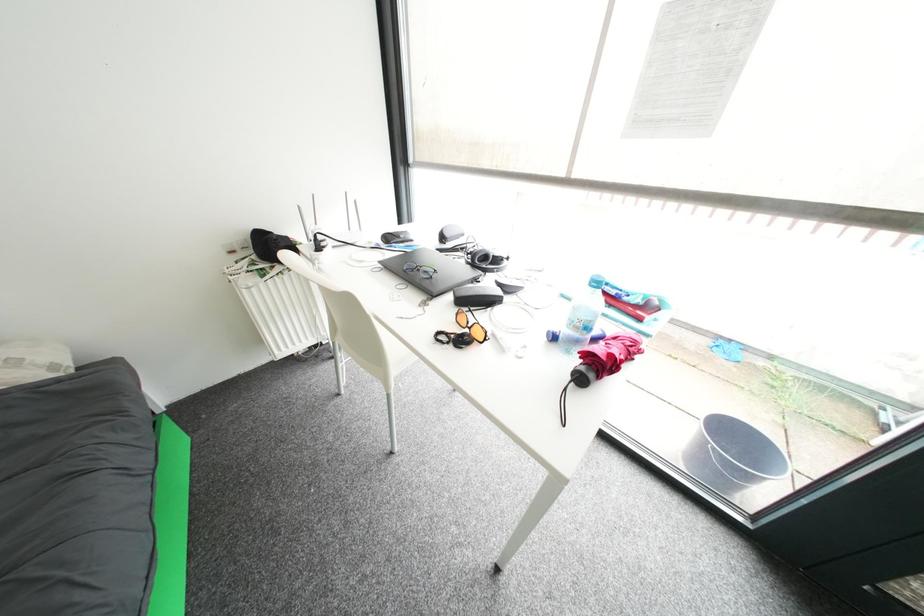
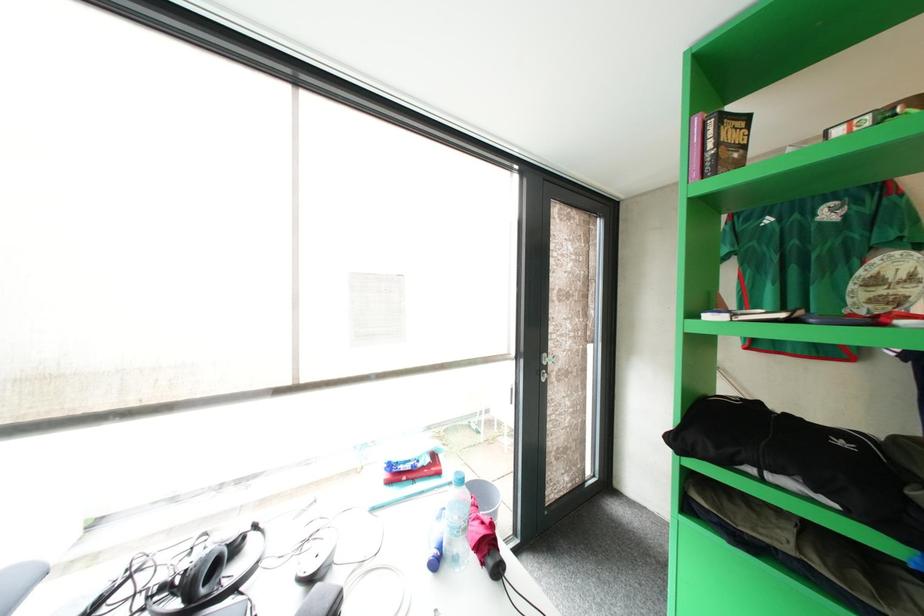
Question: The images are taken continuously from a first-person perspective. In which direction is your viewpoint rotating?

Choices:
 (A) Left
 (B) Right
 (C) Up
 (D) Down

Answer: (B)